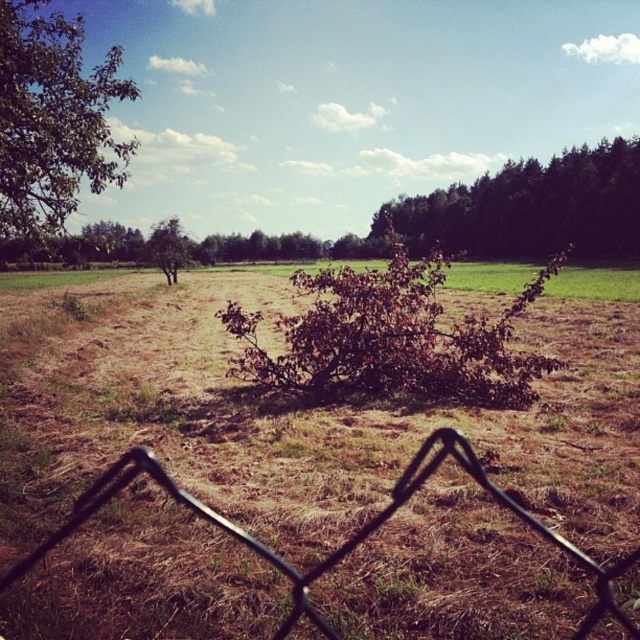
Question: Can you confirm if green leafy tree at upper left is positioned above dark green leafy tree at upper right?

Choices:
 (A) yes
 (B) no

Answer: (A)

Question: Which of these objects is positioned closest to the green leafy tree at center-left?

Choices:
 (A) green grass at center
 (B) brown leafy bush at center
 (C) black wire mesh fence at lower center
 (D) dark green leafy tree at upper right

Answer: (A)

Question: Can you confirm if brown leafy bush at center is thinner than dark green leafy tree at upper right?

Choices:
 (A) yes
 (B) no

Answer: (A)

Question: Does brown leafy bush at center have a larger size compared to green leafy tree at center-left?

Choices:
 (A) yes
 (B) no

Answer: (A)

Question: Which object is the farthest from the green leafy tree at center-left?

Choices:
 (A) dark green leafy tree at upper right
 (B) green leafy tree at upper left
 (C) green grass at center
 (D) brown leafy bush at center

Answer: (A)

Question: Among these points, which one is nearest to the camera?

Choices:
 (A) (596, 269)
 (B) (253, 314)
 (C) (465, 228)
 (D) (179, 253)

Answer: (B)